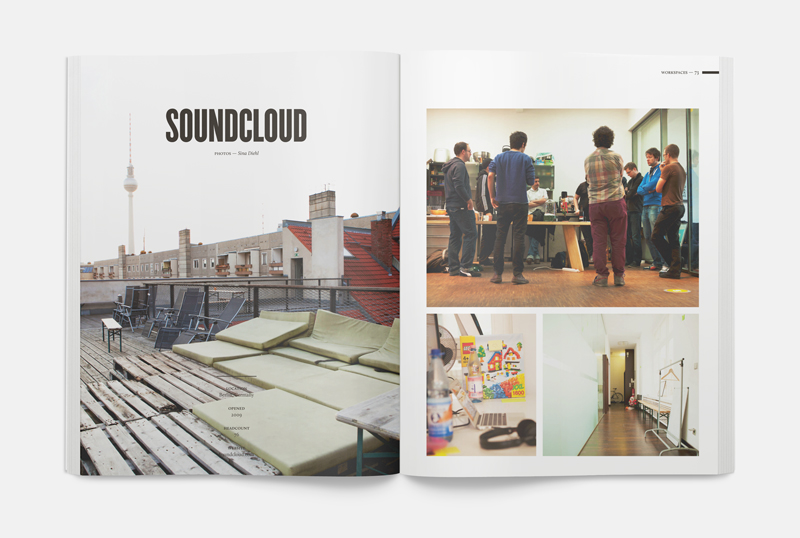
Find the location of a particular element. chair is located at coordinates (178, 320).